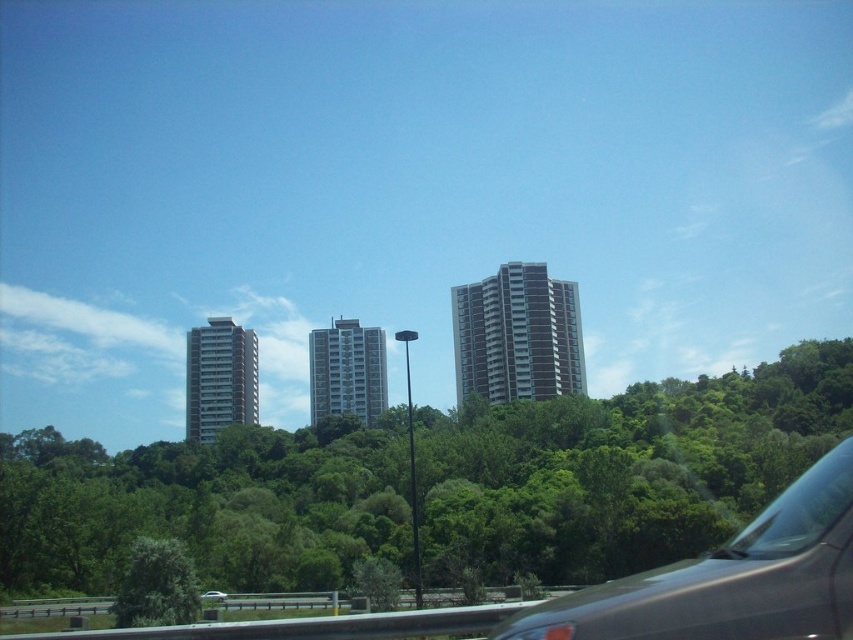
You are a photographer trying to capture the smooth concrete building at left and the black matte car at lower right in a single frame. Given their sizes, which object should you focus on first to ensure both are clearly visible in your photo?

The black matte car at lower right has a smaller size compared to the smooth concrete building at left, so you should focus on the black matte car at lower right first to ensure both are clearly visible in your photo.

You are driving along a road near the green leafy tree at center and the glassy gray building at center. Which one appears closer to you as you look through the windshield?

The green leafy tree at center appears closer because it is in front of the glassy gray building at center.